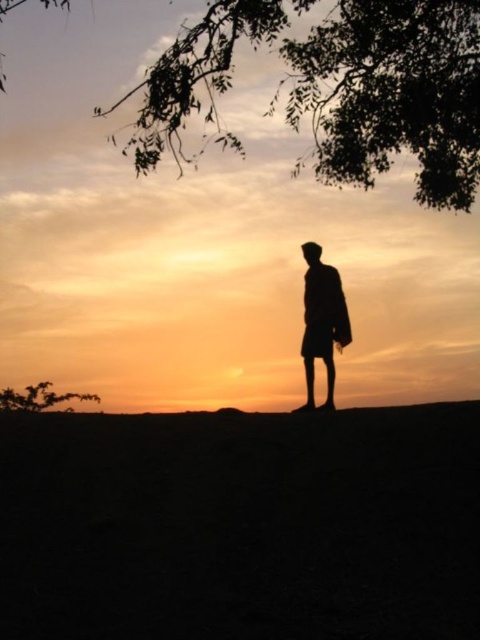
Who is lower down, silhouette leafy branch at upper center or green leafy tree at lower left?

green leafy tree at lower left is lower down.

From the picture: Which of these two, silhouette leafy branch at upper center or green leafy tree at lower left, stands taller?

Standing taller between the two is green leafy tree at lower left.

Describe the element at coordinates (393, 93) in the screenshot. I see `silhouette leafy branch at upper center` at that location.

You are a GUI agent. You are given a task and a screenshot of the screen. Output one action in this format:
    pyautogui.click(x=<x>, y=<y>)
    Task: Click on the silhouette leafy branch at upper center
    The width and height of the screenshot is (480, 640).
    Given the screenshot: What is the action you would take?
    pyautogui.click(x=393, y=93)

Describe the element at coordinates (240, 524) in the screenshot. This screenshot has width=480, height=640. I see `dark soil hill at center` at that location.

Is dark soil hill at center positioned in front of silhouette leafy branch at upper center?

Yes, dark soil hill at center is in front of silhouette leafy branch at upper center.

In order to click on dark soil hill at center in this screenshot , I will do `click(240, 524)`.

Where is `dark soil hill at center`? The height and width of the screenshot is (640, 480). dark soil hill at center is located at coordinates (240, 524).

Does silhouette leafy branch at upper center have a lesser width compared to matte black person at center?

Yes.

From the picture: Who is shorter, silhouette leafy branch at upper center or matte black person at center?

silhouette leafy branch at upper center is shorter.

Which is in front, point (442, 177) or point (305, 364)?

Point (305, 364) is more forward.

You are a GUI agent. You are given a task and a screenshot of the screen. Output one action in this format:
    pyautogui.click(x=<x>, y=<y>)
    Task: Click on the silhouette leafy branch at upper center
    
    Given the screenshot: What is the action you would take?
    pyautogui.click(x=393, y=93)